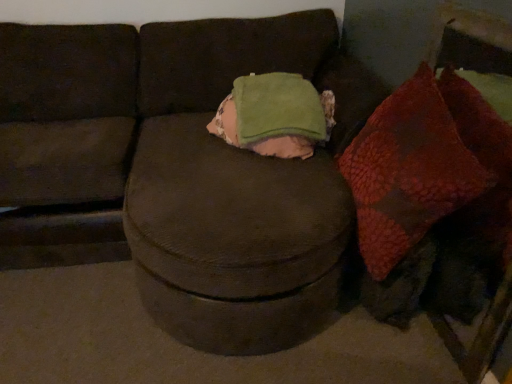
Question: Should I look upward or downward to see brown fabric couch at center?

Choices:
 (A) up
 (B) down

Answer: (A)

Question: From the image's perspective, does green fleece throw pillow at center appear higher than leather-like brown dog at lower right?

Choices:
 (A) no
 (B) yes

Answer: (B)

Question: Considering the relative positions of green fleece throw pillow at center and leather-like brown dog at lower right in the image provided, is green fleece throw pillow at center to the right of leather-like brown dog at lower right from the viewer's perspective?

Choices:
 (A) no
 (B) yes

Answer: (A)

Question: From a real-world perspective, is green fleece throw pillow at center located beneath leather-like brown dog at lower right?

Choices:
 (A) no
 (B) yes

Answer: (A)

Question: Does green fleece throw pillow at center come in front of leather-like brown dog at lower right?

Choices:
 (A) yes
 (B) no

Answer: (B)

Question: Is green fleece throw pillow at center located outside leather-like brown dog at lower right?

Choices:
 (A) no
 (B) yes

Answer: (B)

Question: From a real-world perspective, is green fleece throw pillow at center over leather-like brown dog at lower right?

Choices:
 (A) no
 (B) yes

Answer: (B)

Question: Is leather-like brown dog at lower right not within brown fabric couch at center?

Choices:
 (A) no
 (B) yes

Answer: (A)

Question: Is leather-like brown dog at lower right looking in the opposite direction of brown fabric couch at center?

Choices:
 (A) no
 (B) yes

Answer: (B)

Question: From a real-world perspective, is leather-like brown dog at lower right physically below brown fabric couch at center?

Choices:
 (A) yes
 (B) no

Answer: (A)

Question: Is leather-like brown dog at lower right in front of brown fabric couch at center?

Choices:
 (A) yes
 (B) no

Answer: (B)

Question: Is leather-like brown dog at lower right to the left of brown fabric couch at center from the viewer's perspective?

Choices:
 (A) no
 (B) yes

Answer: (A)

Question: Can you confirm if leather-like brown dog at lower right is wider than brown fabric couch at center?

Choices:
 (A) yes
 (B) no

Answer: (B)

Question: From the image's perspective, does leather-like brown dog at lower right appear higher than green fleece throw pillow at center?

Choices:
 (A) yes
 (B) no

Answer: (B)